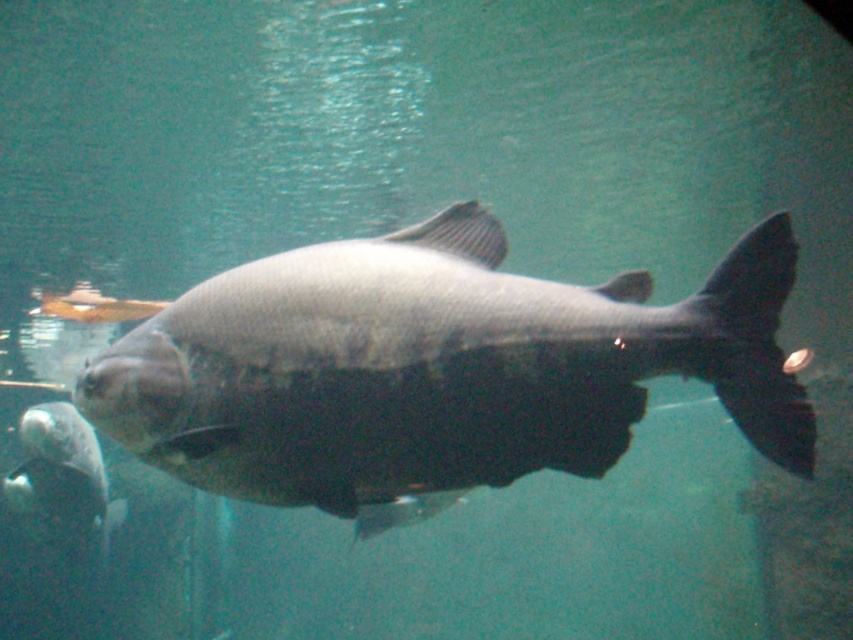
Who is shorter, shiny silver fish at center or shiny silver fish at lower left?

shiny silver fish at center is shorter.

From the picture: Is shiny silver fish at center to the right of shiny silver fish at lower left from the viewer's perspective?

Yes, shiny silver fish at center is to the right of shiny silver fish at lower left.

Does point (367, 433) come farther from viewer compared to point (30, 484)?

No, (367, 433) is in front of (30, 484).

At what (x,y) coordinates should I click in order to perform the action: click on shiny silver fish at center. Please return your answer as a coordinate pair (x, y). The width and height of the screenshot is (853, 640). Looking at the image, I should click on (434, 368).